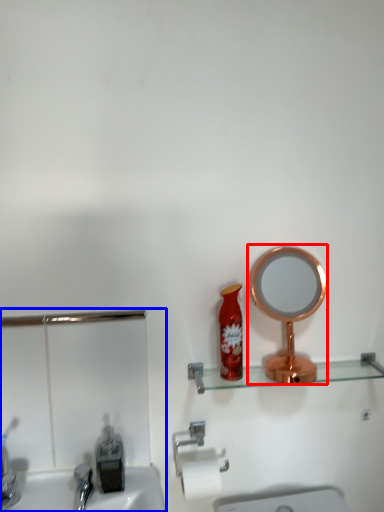
Question: Which of the following is the farthest to the observer, mirror (highlighted by a red box) or sink (highlighted by a blue box)?

Choices:
 (A) mirror
 (B) sink

Answer: (A)